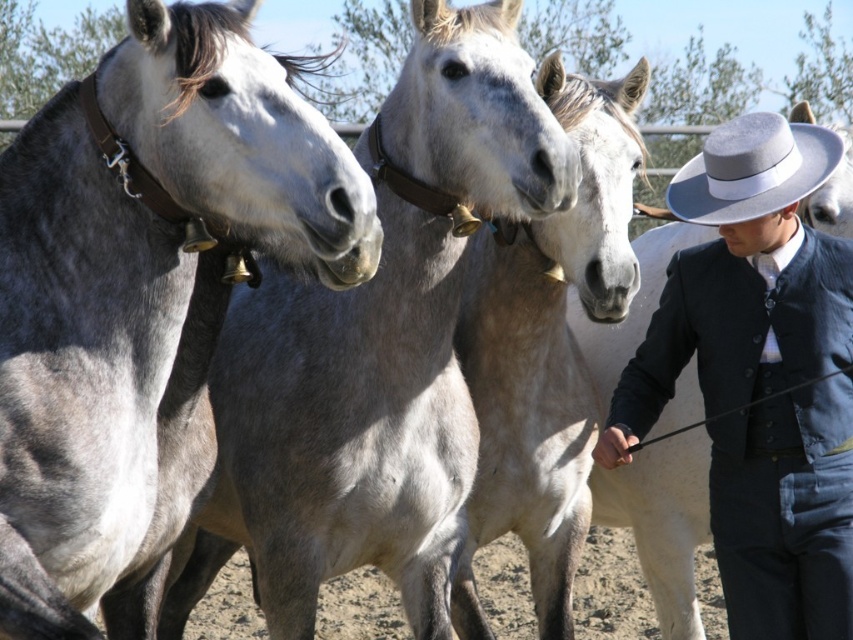
You are a farmer who needs to lead the gray matte horse at left and the gray smooth horse at center to a stable that is 25 inches wide. Can both horses fit side by side through the entrance?

The distance between the gray matte horse at left and gray smooth horse at center is 20.23 inches, which is less than the 25 inch width of the stable entrance. Therefore, both horses can fit side by side through the entrance.

You are a photographer setting up equipment to capture the scene of the gray matte horse at left and the dark blue fabric jacket at center right. You need to ensure both subjects are fully visible in your frame. Given that your camera has a fixed focal length, which subject should you position closer to the camera to maintain their full visibility without cropping?

The gray matte horse at left is wider than the dark blue fabric jacket at center right. To maintain full visibility without cropping, position the gray matte horse at left closer to the camera since its larger width requires more space in the frame.